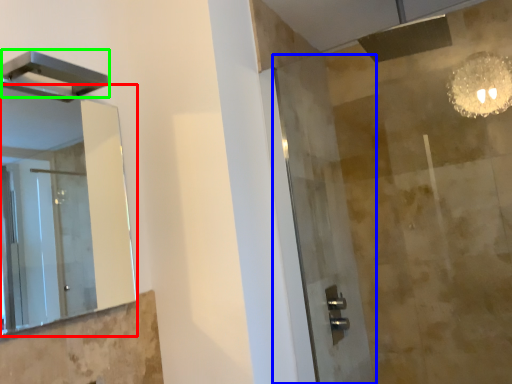
Question: Which is farther away from mirror (highlighted by a red box)? screen door (highlighted by a blue box) or shower (highlighted by a green box)?

Choices:
 (A) screen door
 (B) shower

Answer: (B)